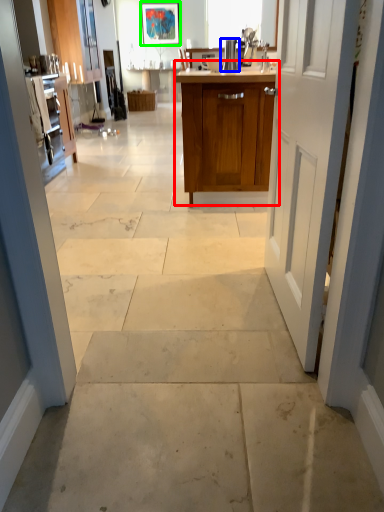
Question: Which object is the farthest from cabinetry (highlighted by a red box)? Choose among these: appliance (highlighted by a blue box) or picture frame (highlighted by a green box).

Choices:
 (A) appliance
 (B) picture frame

Answer: (B)